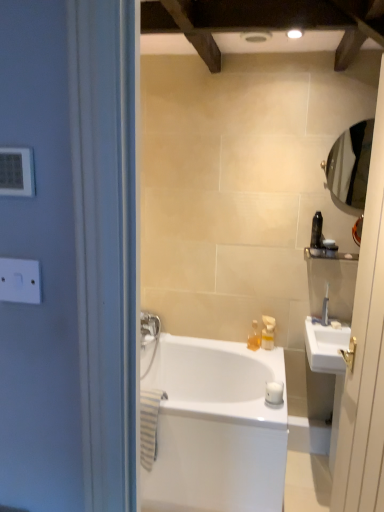
Image resolution: width=384 pixels, height=512 pixels. What are the coordinates of `vacant space situated on the left part of translucent plastic bottles at upper center, the 1th toiletry viewed from the back` in the screenshot? It's located at (232, 348).